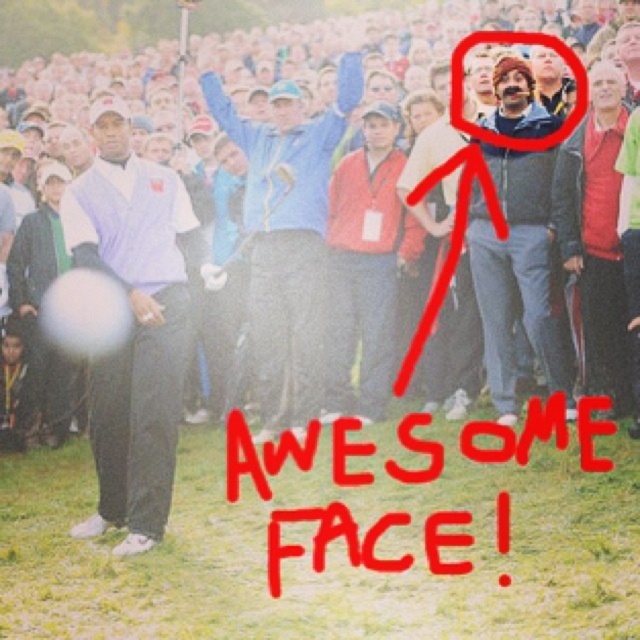
Is white shirt at upper center closer to camera compared to gray fleece jacket at upper right?

Yes.

Is point (454, 356) less distant than point (518, 262)?

No, it is not.

Is point (237, 65) farther from camera compared to point (493, 285)?

Yes, it is.

In order to click on white shirt at upper center in this screenshot , I will do `click(88, 97)`.

Is blue fabric jacket at center shorter than blue denim jacket at upper center?

In fact, blue fabric jacket at center may be taller than blue denim jacket at upper center.

Image resolution: width=640 pixels, height=640 pixels. Find the location of `blue fabric jacket at center`. blue fabric jacket at center is located at coordinates (285, 237).

Is white shirt at upper center closer to camera compared to blue denim jacket at upper center?

Yes, white shirt at upper center is closer to the viewer.

Looking at this image, does white shirt at upper center have a lesser height compared to blue denim jacket at upper center?

Incorrect, white shirt at upper center's height does not fall short of blue denim jacket at upper center's.

Which is in front, point (600, 259) or point (618, 128)?

Point (618, 128)

Locate an element on the screen. The width and height of the screenshot is (640, 640). white shirt at upper center is located at coordinates (88, 97).